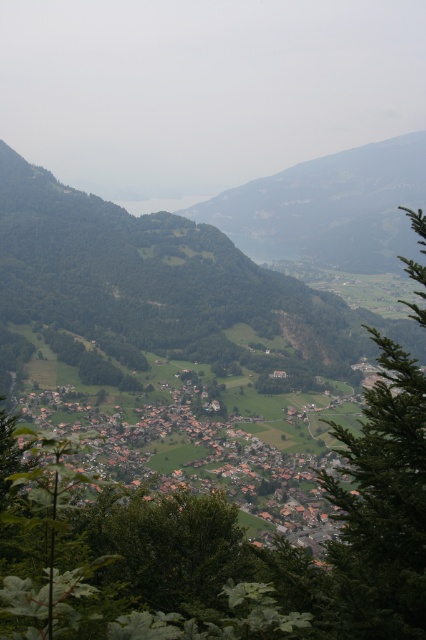
Who is positioned more to the left, green leafy tree at center-right or rocky cliff at center?

From the viewer's perspective, green leafy tree at center-right appears more on the left side.

Who is more forward, (405, 442) or (241, 246)?

Point (405, 442) is in front.

Identify the location of green leafy tree at center-right. (380, 509).

Find the location of `green leafy tree at center-right`. green leafy tree at center-right is located at coordinates (380, 509).

Who is more forward, (402, 628) or (164, 417)?

Point (402, 628) is in front.

Looking at this image, is the position of green leafy tree at center-right less distant than that of brown tiled roofs at center?

Yes, it is.

At what (x,y) coordinates should I click in order to perform the action: click on green leafy tree at center-right. Please return your answer as a coordinate pair (x, y). Looking at the image, I should click on (380, 509).

Who is positioned more to the right, brown tiled roofs at center or rocky cliff at center?

Positioned to the right is rocky cliff at center.

This screenshot has height=640, width=426. What are the coordinates of `brown tiled roofs at center` in the screenshot? It's located at (204, 456).